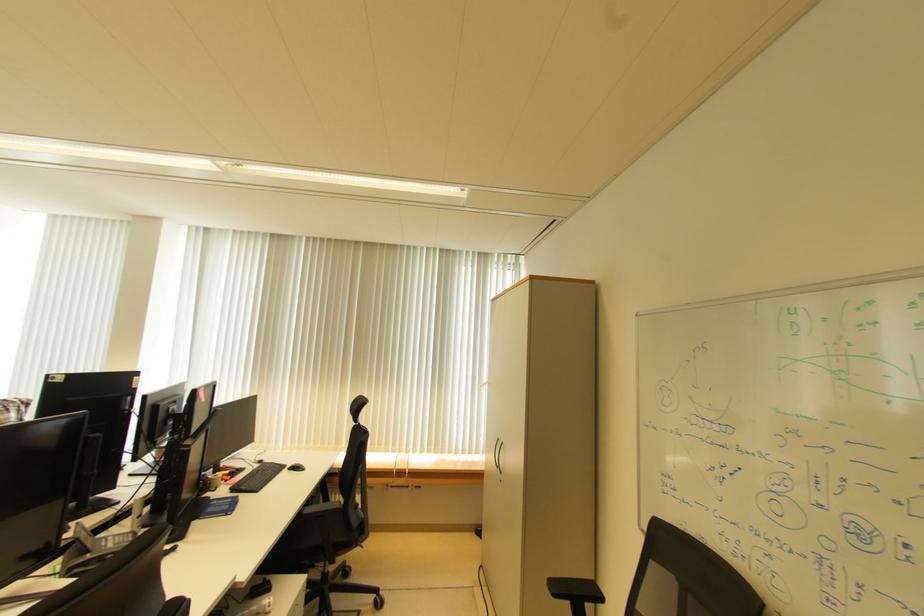
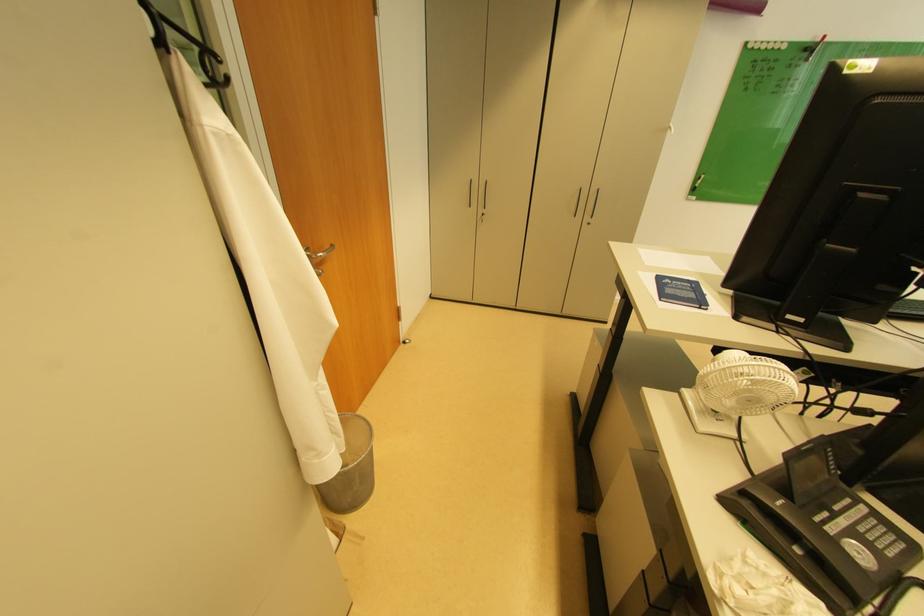
First-person continuous shooting, in which direction is the camera rotating?

The camera's rotation is toward left-down.